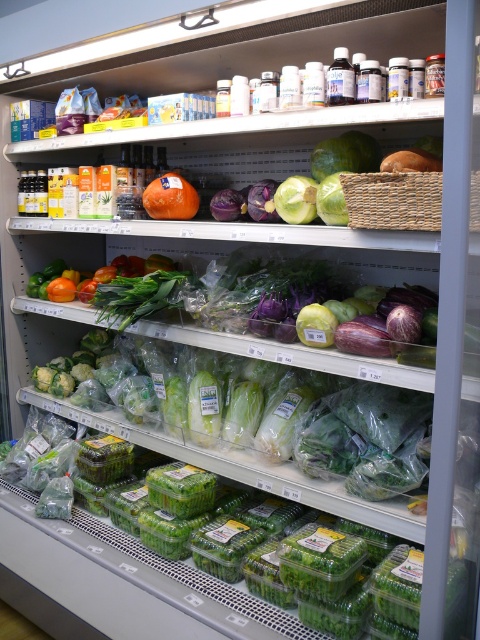
Question: In this image, where is orange matte at center located relative to green matte cabbage at center?

Choices:
 (A) above
 (B) below

Answer: (A)

Question: Does green plastic containers at center appear over green matte cabbage at center?

Choices:
 (A) yes
 (B) no

Answer: (B)

Question: Which of the following is the farthest from the observer?

Choices:
 (A) woven straw basket at center
 (B) green plastic containers at center
 (C) orange matte at center
 (D) green matte cabbage at center

Answer: (C)

Question: Is green plastic containers at center positioned at the back of orange matte at center?

Choices:
 (A) no
 (B) yes

Answer: (A)

Question: Which point appears closest to the camera in this image?

Choices:
 (A) (163, 189)
 (B) (371, 204)
 (C) (292, 186)

Answer: (B)

Question: Which of these objects is positioned farthest from the green matte cabbage at center?

Choices:
 (A) orange matte at center
 (B) woven straw basket at center
 (C) green plastic containers at center

Answer: (C)